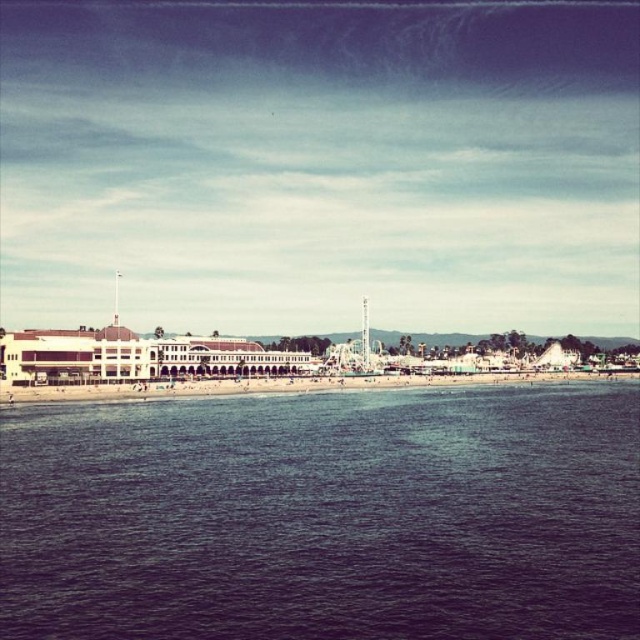
You are a visitor at the beachfront amusement park and want to take a photo that includes both the blue water at lower center and the metallic amusement park ride at center. Which object should you position closer to the edge of the frame to ensure both are visible?

Since the blue water at lower center is larger in size compared to the metallic amusement park ride at center, you should position the metallic amusement park ride at center closer to the edge of the frame to ensure both fit within the photo.

You are standing at the point marked as point (289, 385). What surface are you currently standing on?

The point (289, 385) is on beach sand at lower center, so you are standing on beach sand.

You are standing on the beach sand at lower center and want to get to the blue water at lower center. Which direction should you walk?

The blue water at lower center is located below the beach sand at lower center, so you should walk downward towards the blue water at lower center.